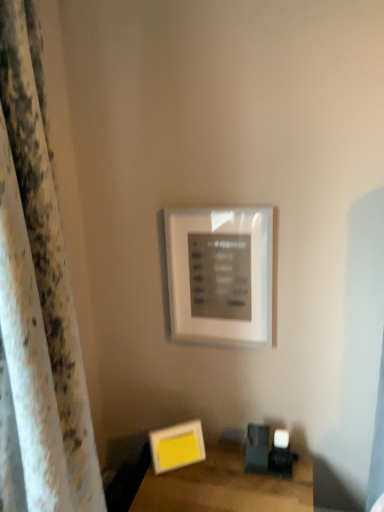
Question: Based on their positions, is white textured curtain at left located to the left or right of wooden table at lower right?

Choices:
 (A) left
 (B) right

Answer: (A)

Question: Considering the positions of white textured curtain at left and wooden table at lower right in the image, is white textured curtain at left taller or shorter than wooden table at lower right?

Choices:
 (A) tall
 (B) short

Answer: (A)

Question: Which is farther from the white matte picture frame at upper center, placed as the first picture frame when sorted from top to bottom?

Choices:
 (A) white textured curtain at left
 (B) wooden table at lower right
 (C) yellow matte picture frame at lower center, marked as the second picture frame in a top-to-bottom arrangement

Answer: (A)

Question: Considering the real-world distances, which object is closest to the white textured curtain at left?

Choices:
 (A) wooden table at lower right
 (B) yellow matte picture frame at lower center, the 1th picture frame from the bottom
 (C) white matte picture frame at upper center, placed as the first picture frame when sorted from top to bottom

Answer: (A)